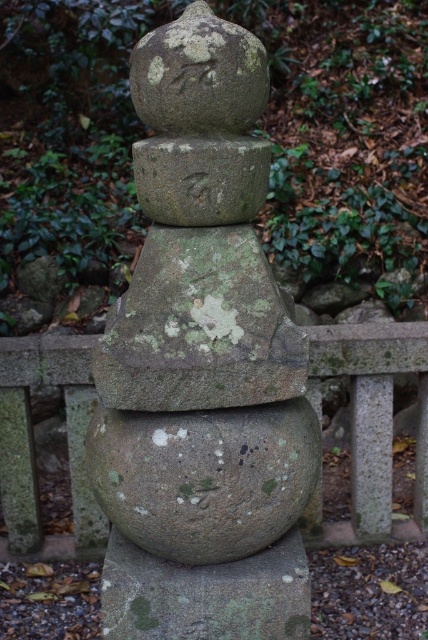
Where is `gray stone fence at center`? gray stone fence at center is located at coordinates (371, 424).

Measure the distance between gray stone fence at center and green mossy stone at center.

gray stone fence at center is 4.25 feet from green mossy stone at center.

Does point (18, 490) come in front of point (143, 566)?

That is False.

Where is `gray stone fence at center`? The image size is (428, 640). gray stone fence at center is located at coordinates (371, 424).

Who is higher up, gray stone statue at center or gray stone fence at center?

gray stone statue at center is higher up.

Does gray stone statue at center appear over gray stone fence at center?

Yes, gray stone statue at center is above gray stone fence at center.

Which is in front, point (186, 211) or point (377, 477)?

Point (186, 211)

Locate an element on the screen. The image size is (428, 640). gray stone statue at center is located at coordinates (202, 365).

Can you confirm if gray stone statue at center is taller than green mossy stone at center?

Yes, gray stone statue at center is taller than green mossy stone at center.

I want to click on gray stone statue at center, so [x=202, y=365].